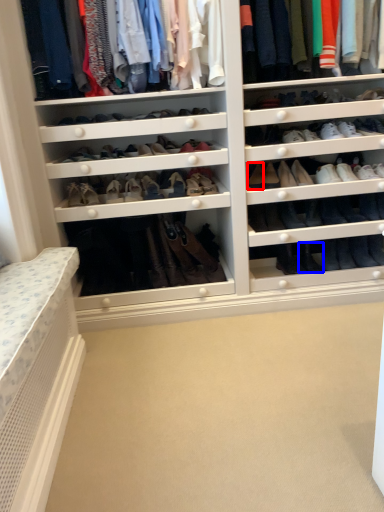
Question: Which point is closer to the camera, shoe (highlighted by a red box) or shoe (highlighted by a blue box)?

Choices:
 (A) shoe
 (B) shoe

Answer: (A)